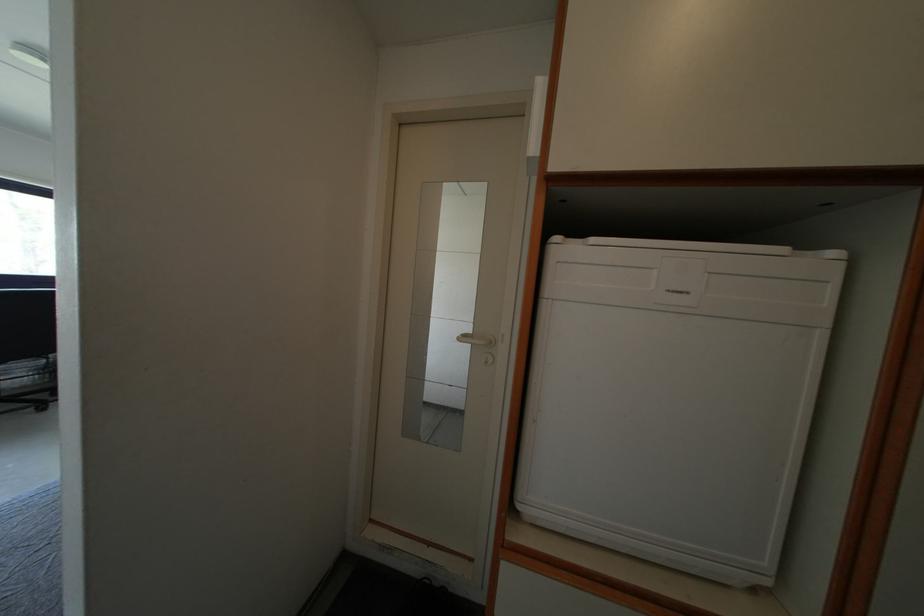
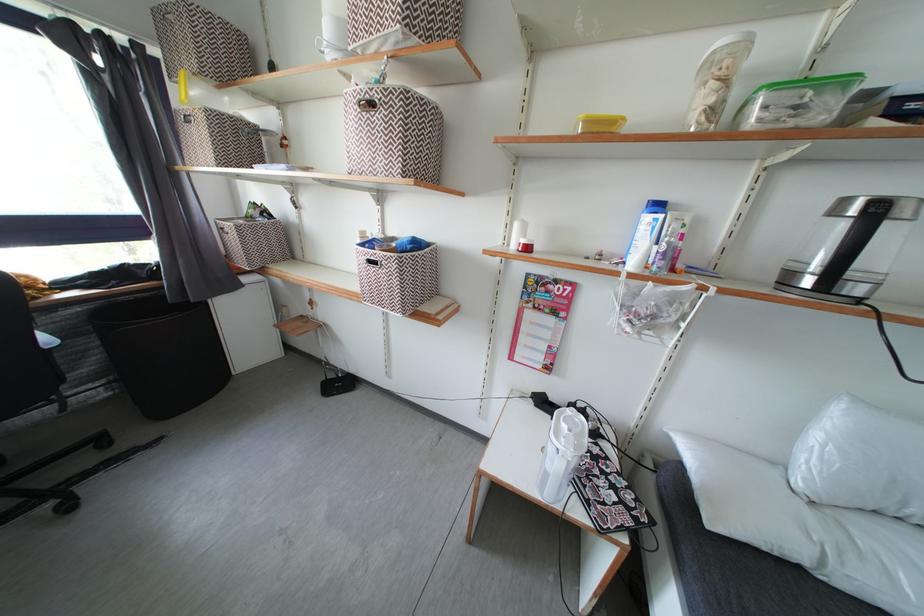
What movement of the cameraman would produce the second image?

The movement direction of the cameraman is left, forward.